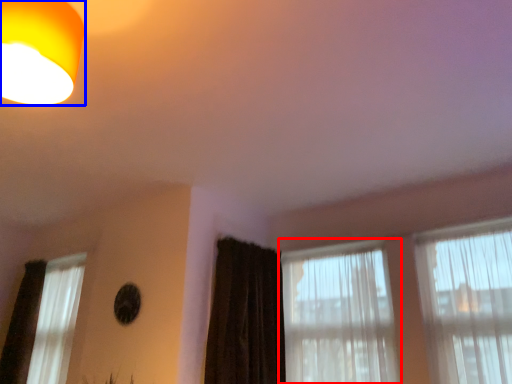
Question: Which object is closer to the camera taking this photo, window (highlighted by a red box) or lamp (highlighted by a blue box)?

Choices:
 (A) window
 (B) lamp

Answer: (B)